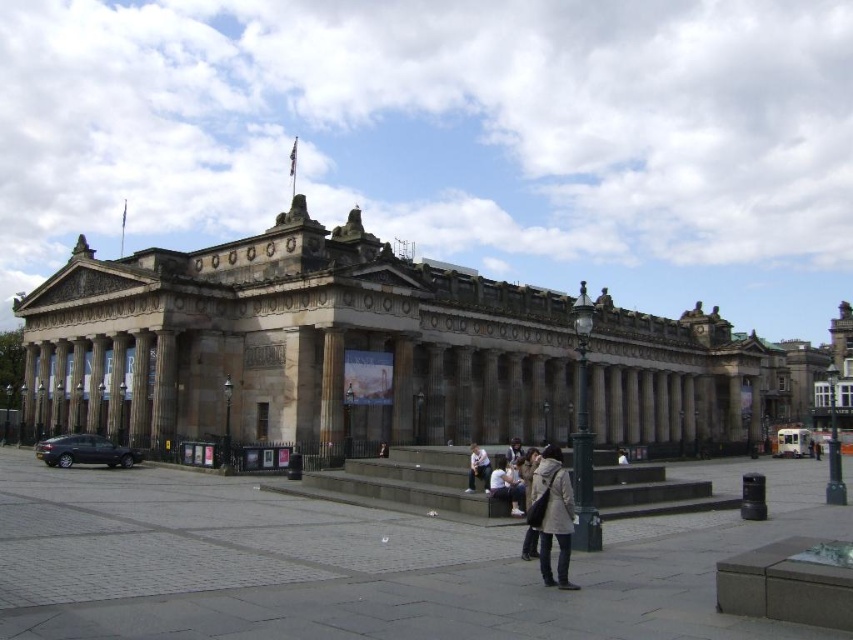
Can you confirm if smooth stone column at center is positioned to the left of light gray fabric jacket at lower center?

Correct, you'll find smooth stone column at center to the left of light gray fabric jacket at lower center.

Does point (332, 376) lie behind point (524, 496)?

Yes, it is.

Is point (334, 432) farther from camera compared to point (494, 477)?

Yes, it is behind point (494, 477).

Where is `smooth stone column at center`? smooth stone column at center is located at coordinates (331, 392).

Is point (558, 486) positioned before point (517, 461)?

Yes, point (558, 486) is closer to viewer.

Measure the distance between light brown leather coat at lower center and camera.

light brown leather coat at lower center and camera are 35.18 meters apart from each other.

This screenshot has width=853, height=640. I want to click on light brown leather coat at lower center, so click(553, 515).

Is light brown leather jacket at lower center to the right of light brown leather jacket at center from the viewer's perspective?

In fact, light brown leather jacket at lower center is to the left of light brown leather jacket at center.

Does light brown leather jacket at lower center appear on the left side of light brown leather jacket at center?

Correct, you'll find light brown leather jacket at lower center to the left of light brown leather jacket at center.

Which is in front, point (469, 483) or point (506, 451)?

Point (469, 483) is in front.

Image resolution: width=853 pixels, height=640 pixels. Find the location of `light brown leather jacket at lower center`. light brown leather jacket at lower center is located at coordinates (477, 467).